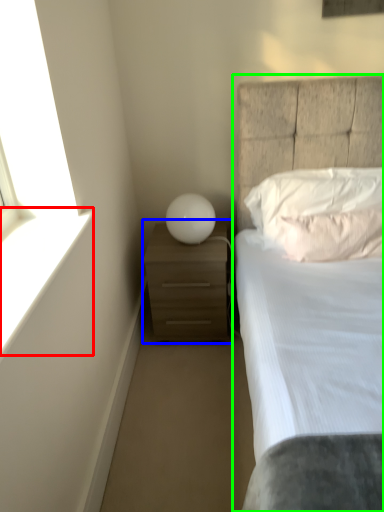
Question: Which object is positioned closest to window sill (highlighted by a red box)? Select from nightstand (highlighted by a blue box) and bed (highlighted by a green box).

Choices:
 (A) nightstand
 (B) bed

Answer: (A)